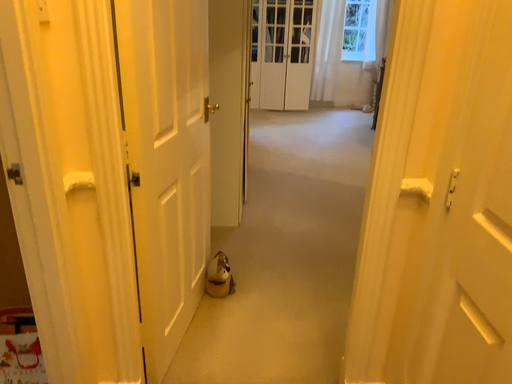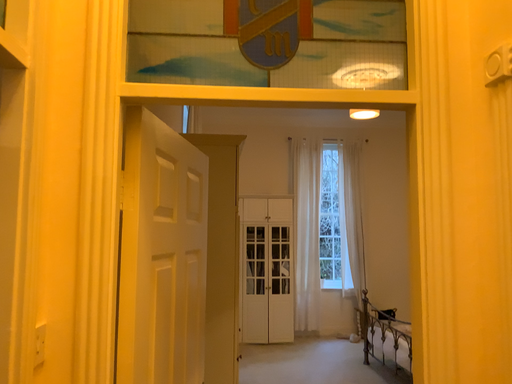
Question: How did the camera likely rotate when shooting the video?

Choices:
 (A) rotated upward
 (B) rotated downward

Answer: (A)